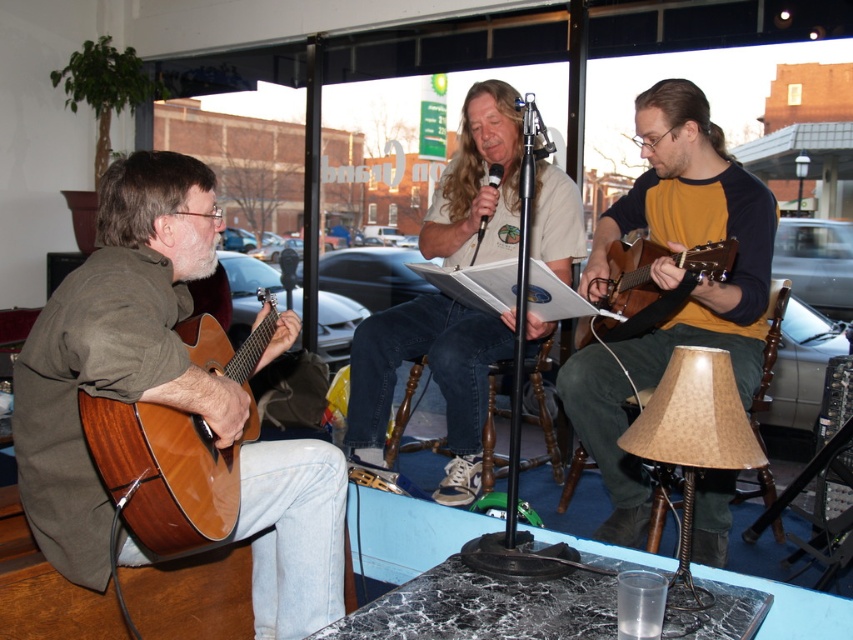
You are a photographer standing in the center of the room. You want to take a photo of the matte brown guitar at left and the matte brown guitar at center. Which guitar is positioned lower in the frame?

The matte brown guitar at left is located below the matte brown guitar at center, so it will appear lower in the frame.

You are a photographer positioned at the front of the stage. You want to take a photo of both the matte brown guitar at center and the matte brown acoustic guitar at right. Can you see both guitars in your frame without any obstruction?

The matte brown acoustic guitar at right is behind the matte brown guitar at center, so the matte brown acoustic guitar at right will be partially or fully obstructed by the matte brown guitar at center in the photo.

You are a musician who just arrived at the venue and see the shiny brown acoustic guitar at left and the matte brown acoustic guitar at right. Which guitar is closer to you?

The shiny brown acoustic guitar at left is closer to you since it is positioned to the left of the matte brown acoustic guitar at right.